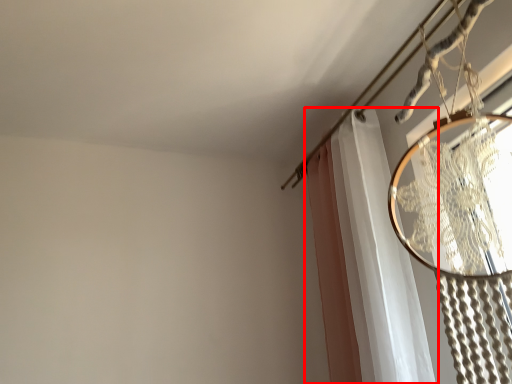
Question: Observing the image, what is the correct spatial positioning of curtain (annotated by the red box) in reference to clothesline?

Choices:
 (A) left
 (B) right

Answer: (A)